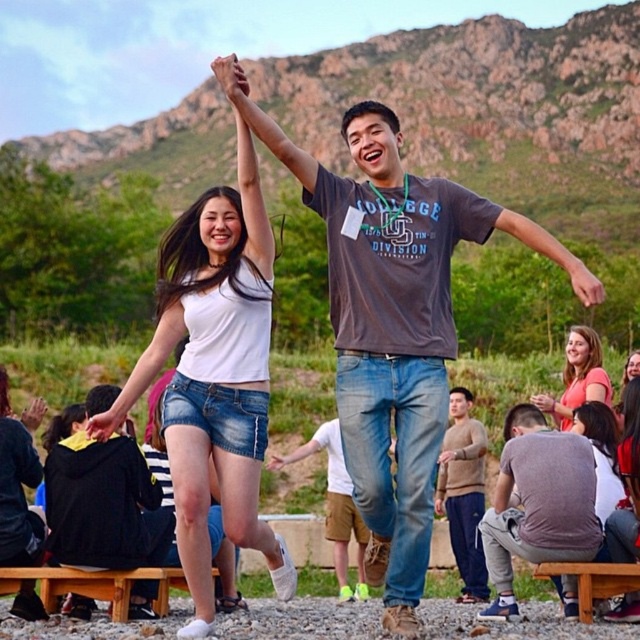
You are standing in the scene and want to place a small flag at each of the two points labeled point (35, 429) and point (272, 461). Which point will require you to walk further back to reach?

Point (272, 461) is further away from the viewer than point (35, 429), so you will need to walk further back to reach point (272, 461).